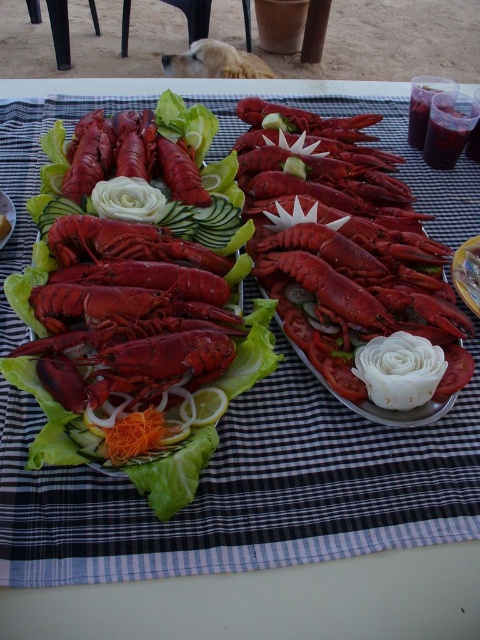
Is green leafy lettuce at lower left behind smooth orange cheese at center?

No, green leafy lettuce at lower left is in front of smooth orange cheese at center.

Can you confirm if green leafy lettuce at lower left is bigger than smooth orange cheese at center?

Yes.

Does point (2, 209) come in front of point (0, 225)?

No, it is behind (0, 225).

Identify the location of green leafy lettuce at lower left. This screenshot has height=640, width=480. (6, 218).

Consider the image. Does orange shredded carrot at center have a smaller size compared to smooth orange cheese at center?

Answer: No, orange shredded carrot at center is not smaller than smooth orange cheese at center.

Can you confirm if orange shredded carrot at center is taller than smooth orange cheese at center?

Indeed, orange shredded carrot at center has a greater height compared to smooth orange cheese at center.

This screenshot has width=480, height=640. Find the location of `orange shredded carrot at center`. orange shredded carrot at center is located at coordinates (136, 435).

Between shiny red lobster at center and smooth orange cheese at center, which one has less height?

With less height is smooth orange cheese at center.

Does shiny red lobster at center come behind smooth orange cheese at center?

No, shiny red lobster at center is in front of smooth orange cheese at center.

Is point (351, 346) less distant than point (1, 218)?

That is True.

Identify the location of shiny red lobster at center. Image resolution: width=480 pixels, height=640 pixels. (344, 248).